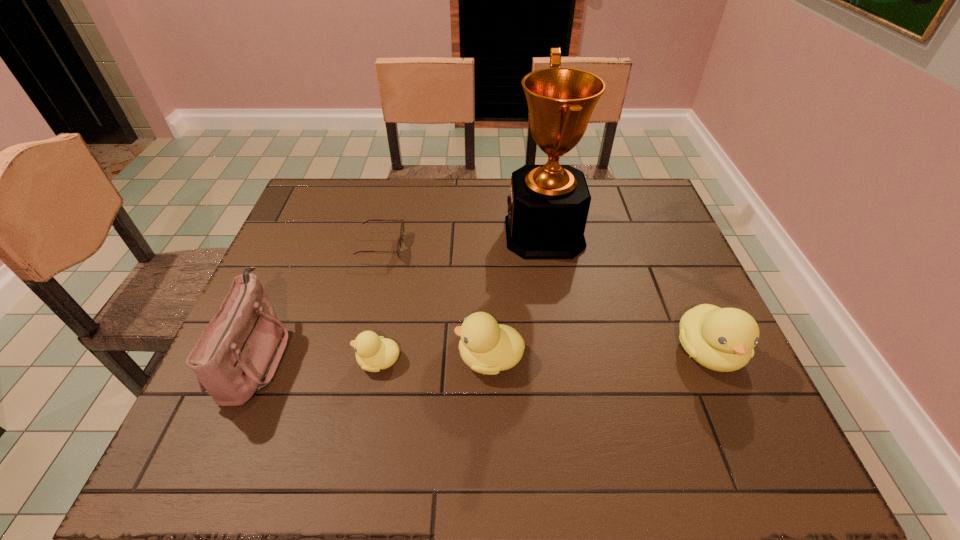
Where is `object that is positioned at the far edge`? This screenshot has height=540, width=960. object that is positioned at the far edge is located at coordinates (548, 206).

This screenshot has height=540, width=960. I want to click on shoulder bag located at the near edge, so click(x=238, y=353).

I want to click on object present at the left edge, so click(x=238, y=353).

What are the coordinates of `object present at the right edge` in the screenshot? It's located at (722, 339).

Where is `object at the near left corner`? The width and height of the screenshot is (960, 540). object at the near left corner is located at coordinates (238, 353).

This screenshot has width=960, height=540. What are the coordinates of `object located at the near right corner` in the screenshot? It's located at (722, 339).

Where is `vacant space at the far edge`? The height and width of the screenshot is (540, 960). vacant space at the far edge is located at coordinates (464, 184).

In the image, there is a desktop. Where is `vacant space at the near edge`? Image resolution: width=960 pixels, height=540 pixels. vacant space at the near edge is located at coordinates (435, 380).

In the image, there is a desktop. Where is `vacant space at the left edge`? vacant space at the left edge is located at coordinates (288, 232).

This screenshot has height=540, width=960. In the image, there is a desktop. In order to click on blank space at the right edge in this screenshot , I will do (x=679, y=326).